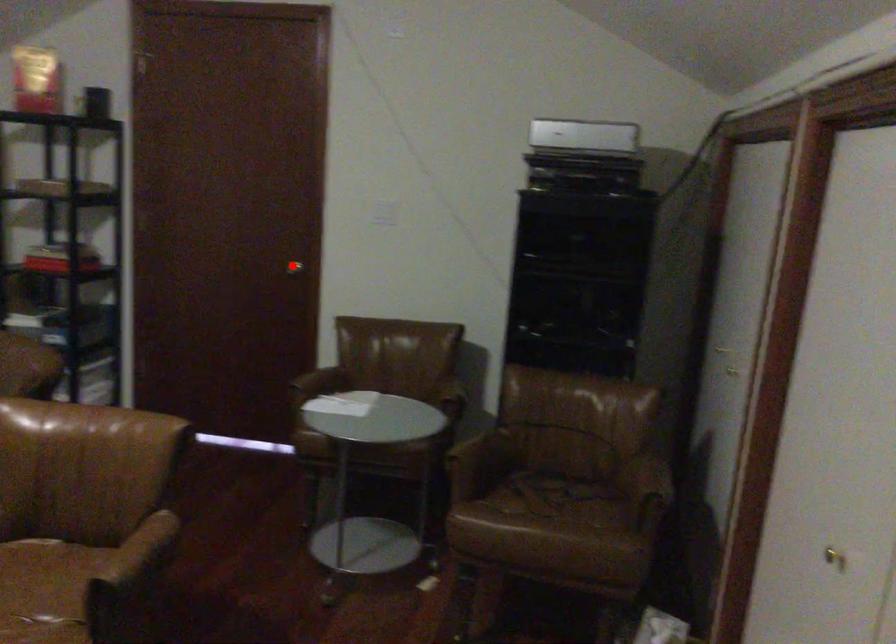
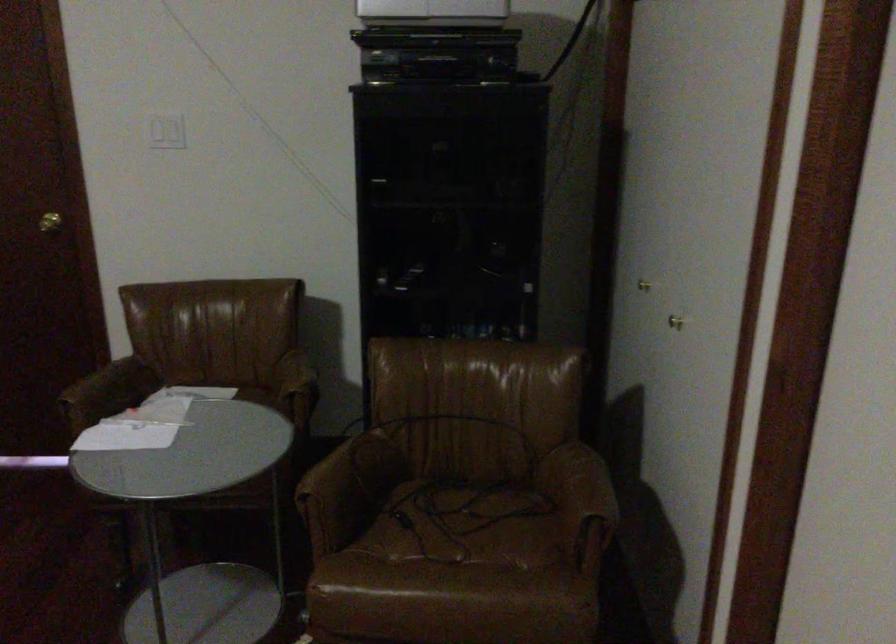
The point at the highlighted location is marked in the first image. Where is the corresponding point in the second image?

(49, 222)